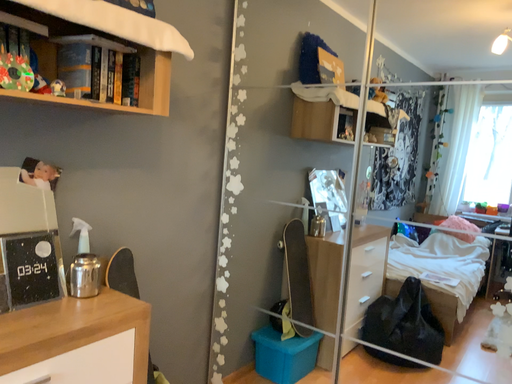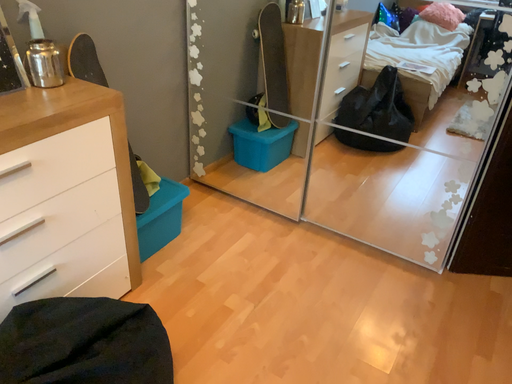
Question: Which way did the camera rotate in the video?

Choices:
 (A) rotated upward
 (B) rotated downward

Answer: (B)